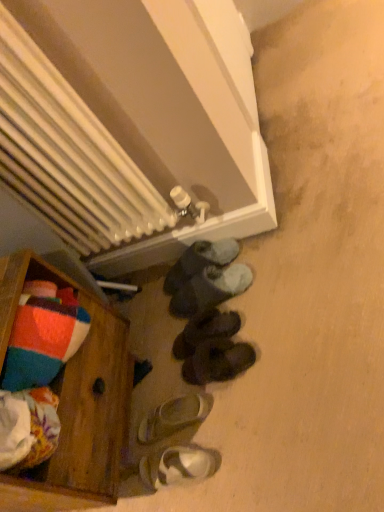
Locate an element on the screen. The height and width of the screenshot is (512, 384). vacant space that is to the left of blue fuzzy slippers at center, the first footwear from the top is located at coordinates (148, 313).